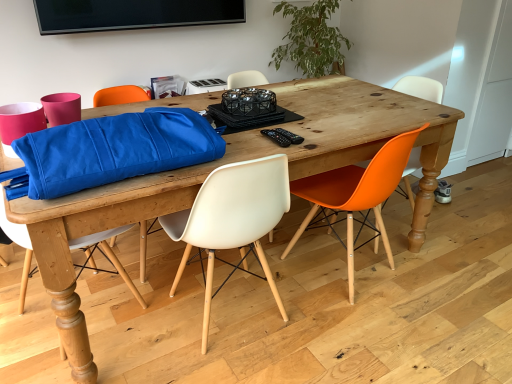
Question: Should I look upward or downward to see white plastic chair at center, which is the fourth chair from right to left?

Choices:
 (A) down
 (B) up

Answer: (A)

Question: Does orange matte plastic chair at right, placed as the 3th chair when sorted from left to right, have a lesser width compared to black plastic remote control at center, which is the 2th remote control in right-to-left order?

Choices:
 (A) yes
 (B) no

Answer: (B)

Question: Is orange matte plastic chair at right, which is the second chair from right to left, completely or partially outside of black plastic remote control at center, the 1th remote control in the left-to-right sequence?

Choices:
 (A) yes
 (B) no

Answer: (A)

Question: Is orange matte plastic chair at right, which is the second chair from right to left, facing towards black plastic remote control at center, the 1th remote control in the left-to-right sequence?

Choices:
 (A) yes
 (B) no

Answer: (B)

Question: Considering the relative positions of orange matte plastic chair at right, which is the second chair from right to left, and black plastic remote control at center, which is the 2th remote control in right-to-left order, in the image provided, is orange matte plastic chair at right, which is the second chair from right to left, to the left of black plastic remote control at center, which is the 2th remote control in right-to-left order, from the viewer's perspective?

Choices:
 (A) no
 (B) yes

Answer: (A)

Question: Does orange matte plastic chair at right, placed as the 3th chair when sorted from left to right, contain black plastic remote control at center, which is the 2th remote control in right-to-left order?

Choices:
 (A) yes
 (B) no

Answer: (B)

Question: From a real-world perspective, does orange matte plastic chair at right, which is the second chair from right to left, sit lower than black plastic remote control at center, the 1th remote control in the left-to-right sequence?

Choices:
 (A) no
 (B) yes

Answer: (B)

Question: Is wooden table at center positioned with its back to black plastic remote control at center, which is the 2th remote control in right-to-left order?

Choices:
 (A) no
 (B) yes

Answer: (A)

Question: Does wooden table at center have a lesser height compared to black plastic remote control at center, which is the 2th remote control in right-to-left order?

Choices:
 (A) no
 (B) yes

Answer: (A)

Question: From a real-world perspective, is wooden table at center on black plastic remote control at center, the 1th remote control in the left-to-right sequence?

Choices:
 (A) no
 (B) yes

Answer: (A)

Question: Does wooden table at center have a smaller size compared to black plastic remote control at center, which is the 2th remote control in right-to-left order?

Choices:
 (A) no
 (B) yes

Answer: (A)

Question: Does wooden table at center appear on the right side of black plastic remote control at center, which is the 2th remote control in right-to-left order?

Choices:
 (A) no
 (B) yes

Answer: (A)

Question: Is the depth of wooden table at center less than that of black plastic remote control at center, the 1th remote control in the left-to-right sequence?

Choices:
 (A) yes
 (B) no

Answer: (A)

Question: From a real-world perspective, is green leafy plant at upper center positioned over black plastic remote control at center, which is the 2th remote control in right-to-left order, based on gravity?

Choices:
 (A) no
 (B) yes

Answer: (B)